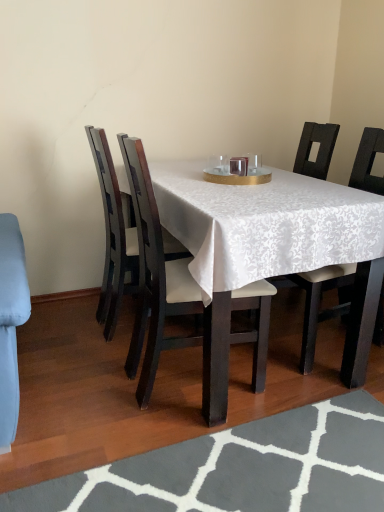
Question: Looking at the image, does gray textured rug at lower center seem bigger or smaller compared to white fabric-covered chair at center, which is counted as the second chair, starting from the left?

Choices:
 (A) big
 (B) small

Answer: (B)

Question: Considering their positions, is gray textured rug at lower center located in front of or behind white fabric-covered chair at center, which is counted as the 3th chair, starting from the right?

Choices:
 (A) front
 (B) behind

Answer: (A)

Question: Estimate the real-world distances between objects in this image. Which object is farther from the white fabric chair at center, acting as the 3th chair starting from the left?

Choices:
 (A) white fabric chair at center, acting as the 4th chair starting from the left
 (B) gold textured tray at center
 (C) dark wood chair at left, the 4th chair when ordered from right to left
 (D) white fabric-covered chair at center, which is counted as the 3th chair, starting from the right
 (E) gray textured rug at lower center

Answer: (E)

Question: Estimate the real-world distances between objects in this image. Which object is closer to the white fabric chair at center, placed as the 2th chair when sorted from right to left?

Choices:
 (A) white fabric-covered chair at center, which is counted as the second chair, starting from the left
 (B) gold textured tray at center
 (C) dark wood chair at left, which is counted as the 1th chair, starting from the left
 (D) gray textured rug at lower center
 (E) white fabric chair at center, which ranks as the first chair in right-to-left order

Answer: (B)